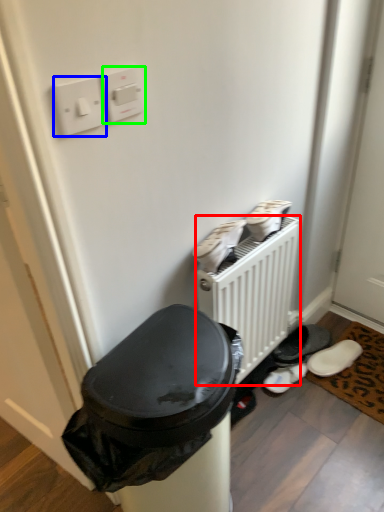
Question: Which object is the closest to the radiator (highlighted by a red box)? Choose among these: light switch (highlighted by a blue box) or light switch (highlighted by a green box).

Choices:
 (A) light switch
 (B) light switch

Answer: (B)